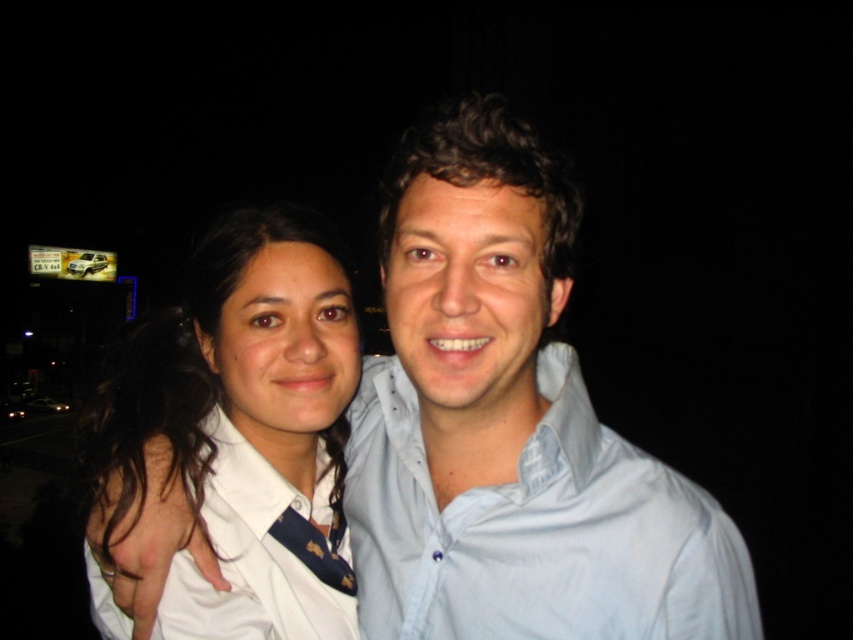
You are a photographer trying to capture a clear photo of both the light blue cotton shirt at center and the white shirt at center. Since the background is dark, you want to ensure both shirts are well lit. Which shirt should you adjust the lighting towards to ensure both are visible?

The light blue cotton shirt at center is positioned on the right side of white shirt at center. To ensure both are visible, adjust the lighting towards the right side where the light blue cotton shirt at center is located, as it is positioned further right and may require additional light to balance with the white shirt at center.

You are a photographer adjusting the camera focus. You need to ensure both the light blue cotton shirt at center and the blue silk tie at center are in focus. Which object should you focus on first to ensure depth of field captures both?

You should focus on the light blue cotton shirt at center first since it is above the blue silk tie at center, allowing the depth of field to cover both objects when using appropriate aperture settings.

You are a photographer adjusting the camera settings to capture the two individuals in the scene. You notice the light blue cotton shirt at center and the blue silk tie at center. Which clothing item is positioned more to the right side of the image?

The light blue cotton shirt at center is positioned to the right of the blue silk tie at center, so the light blue cotton shirt at center is more to the right side of the image.